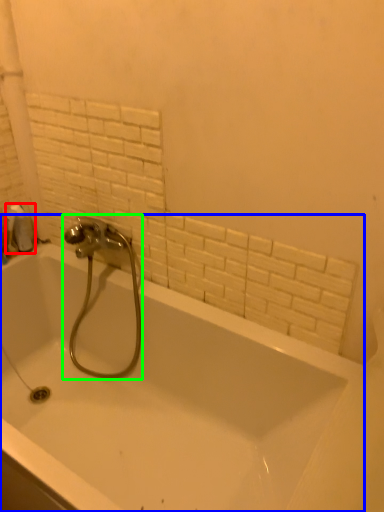
Question: Which object is the closest to the toilet paper (highlighted by a red box)? Choose among these: bathtub (highlighted by a blue box) or tap (highlighted by a green box).

Choices:
 (A) bathtub
 (B) tap

Answer: (B)